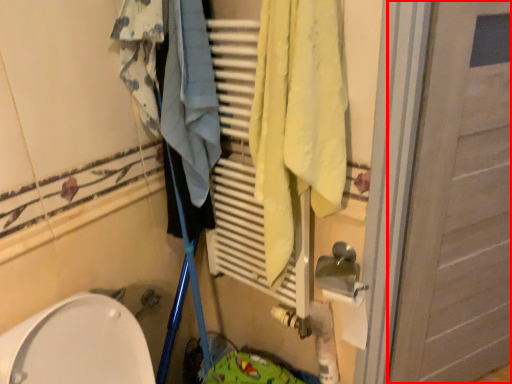
Question: Where is door (annotated by the red box) located in relation to clothing in the image?

Choices:
 (A) left
 (B) right

Answer: (B)